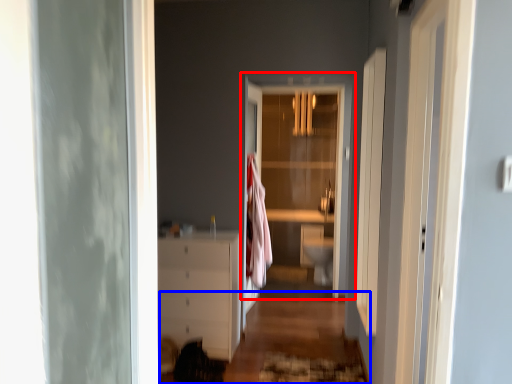
Question: Which point is further to the camera, door (highlighted by a red box) or path (highlighted by a blue box)?

Choices:
 (A) door
 (B) path

Answer: (A)